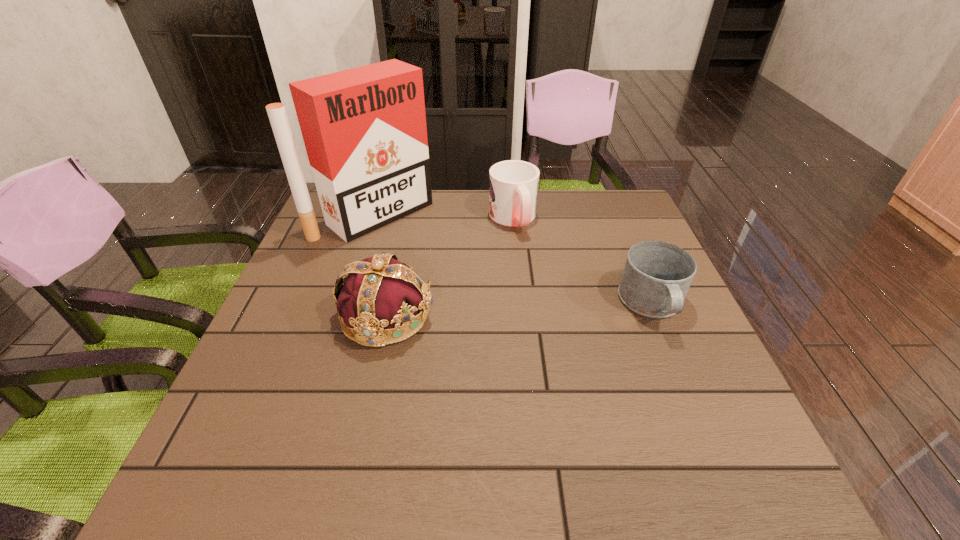
Locate an element on the screen. This screenshot has width=960, height=540. blank area at the far edge is located at coordinates (444, 191).

Where is `vacant space at the near edge of the desktop`? This screenshot has height=540, width=960. vacant space at the near edge of the desktop is located at coordinates (591, 404).

Where is `vacant space at the right edge`? The width and height of the screenshot is (960, 540). vacant space at the right edge is located at coordinates (690, 325).

The image size is (960, 540). I want to click on vacant region at the near left corner of the desktop, so click(x=239, y=416).

Image resolution: width=960 pixels, height=540 pixels. What are the coordinates of `free space at the near right corner of the desktop` in the screenshot? It's located at (692, 416).

Find the location of a particular element. The height and width of the screenshot is (540, 960). unoccupied area between the third tallest object and the shortest object is located at coordinates point(583,262).

In order to click on free space between the farther mug and the tallest object in this screenshot , I will do `click(444, 217)`.

The image size is (960, 540). Identify the location of free space between the cigarette case and the shortest object. (514, 260).

The image size is (960, 540). In order to click on vacant area that lies between the crown and the left mug in this screenshot , I will do tap(449, 267).

The height and width of the screenshot is (540, 960). In order to click on free space between the crown and the shorter mug in this screenshot , I will do `click(519, 310)`.